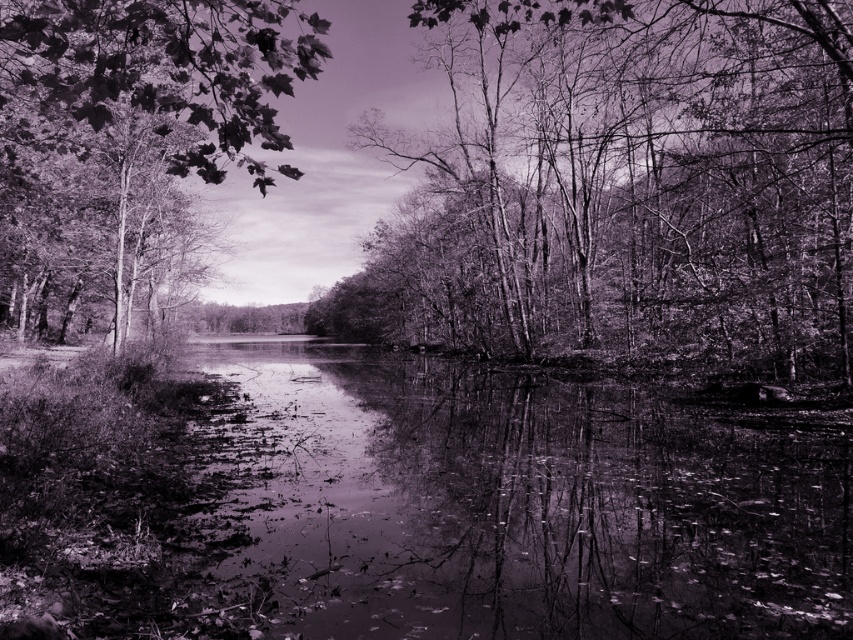
You are looking at the landscape and notice two points marked in the image. Which point, point [730,275] or point [311,33], is closer to you?

Point [730,275] is closer to the camera than point [311,33].

You are standing at the center of the image and want to find the smooth bark trees at center. According to the coordinates provided, in which direction should you look to locate them?

The smooth bark trees at center are located at coordinates point (625, 188), so you should look towards the lower right direction from the center to find them.